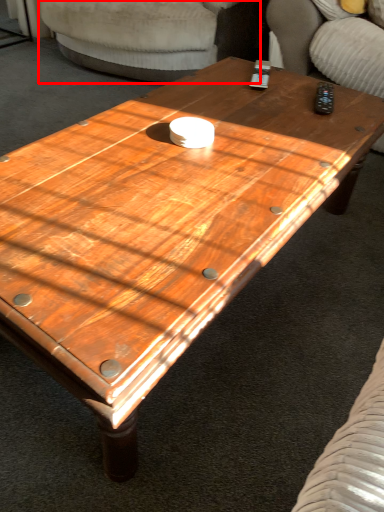
Question: Where is armchair (annotated by the red box) located in relation to armchair in the image?

Choices:
 (A) left
 (B) right

Answer: (A)